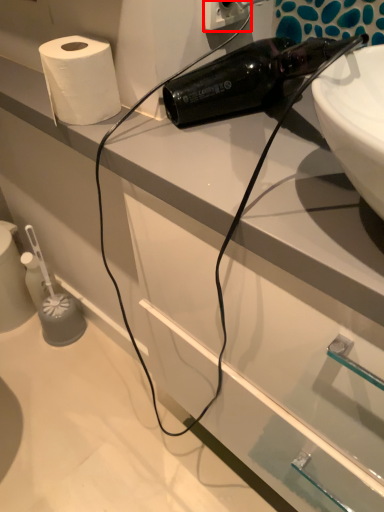
Question: From the image's perspective, what is the correct spatial relationship of electric outlet (annotated by the red box) in relation to paper towel?

Choices:
 (A) above
 (B) below

Answer: (A)